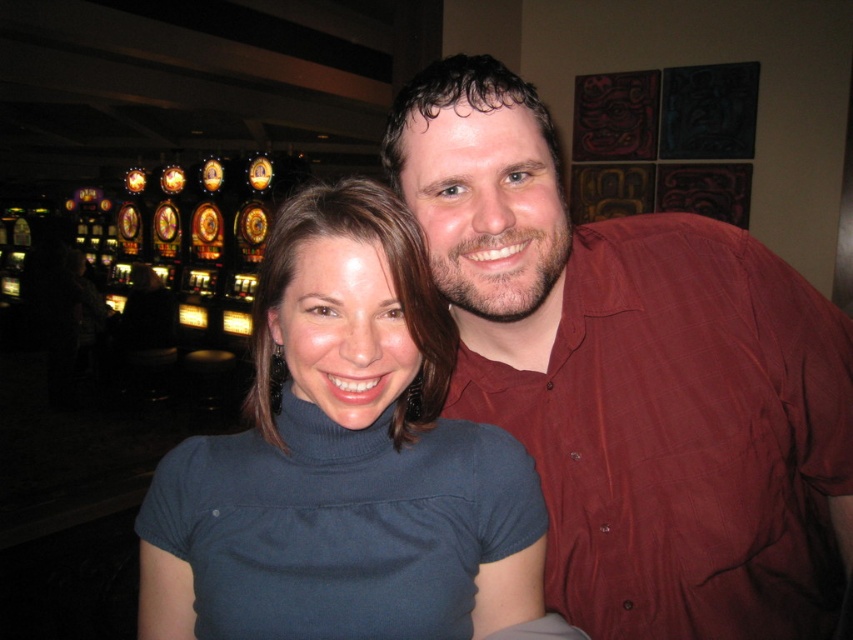
Question: Is matte red shirt at upper right to the right of dark blue turtleneck at center from the viewer's perspective?

Choices:
 (A) no
 (B) yes

Answer: (B)

Question: Which point appears closest to the camera in this image?

Choices:
 (A) (572, 243)
 (B) (543, 561)

Answer: (B)

Question: From the image, what is the correct spatial relationship of matte red shirt at upper right in relation to dark blue turtleneck at center?

Choices:
 (A) right
 (B) left

Answer: (A)

Question: Is matte red shirt at upper right behind dark blue turtleneck at center?

Choices:
 (A) yes
 (B) no

Answer: (A)

Question: Which point appears farthest from the camera in this image?

Choices:
 (A) (508, 472)
 (B) (619, 346)

Answer: (B)